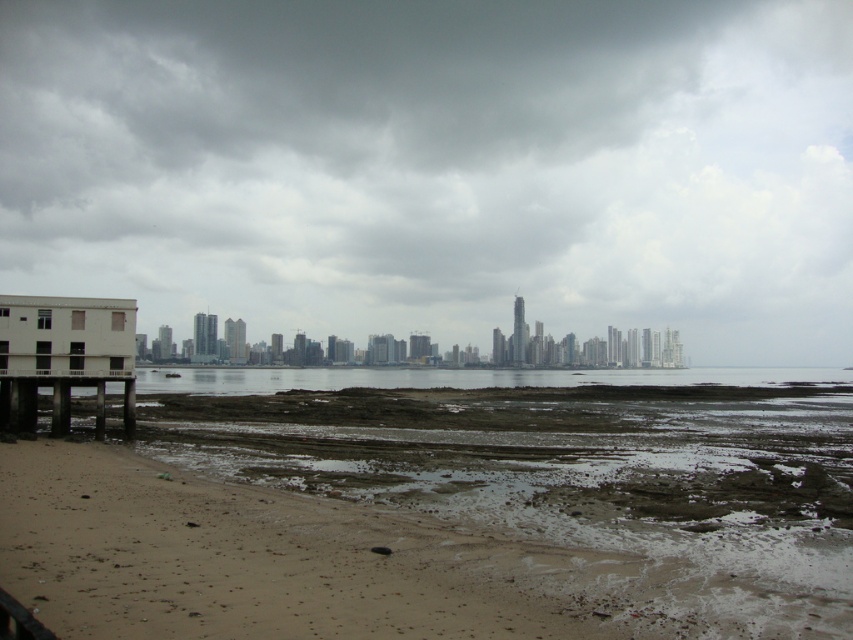
You are standing on the white concrete dock at lower left and want to walk to the brown sandy beach at lower left. Which direction should you move relative to the dock?

You should move to the right relative to the white concrete dock at lower left because the brown sandy beach at lower left is located to the right of the dock.

You are a photographer planning to capture the entire city skyline reflected in the water. You notice the gray cloudy sky at center and the white concrete dock at lower left in your viewfinder. Which object might block your view of the city skyline reflection if positioned improperly?

The white concrete dock at lower left might block the view of the city skyline reflection because its width is narrower than the gray cloudy sky at center, making it easier to position it out of the frame or adjust the angle to avoid obstruction.